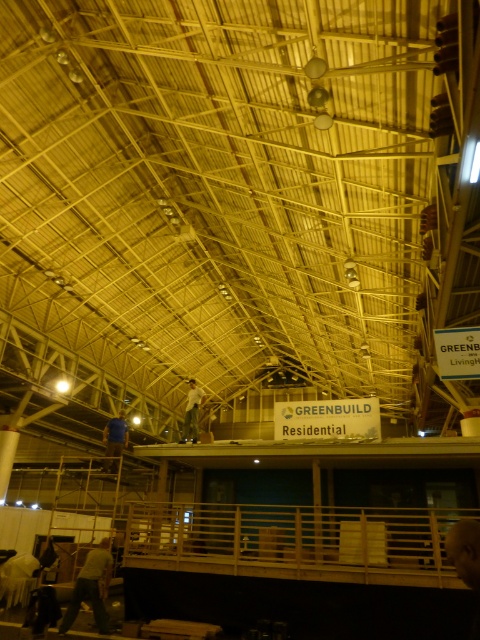
You are standing at the origin point of the coordinate system in the image. The coordinate system has its origin at the bottom left corner of the image. You need to locate the light gray fabric pants at lower left. What are their coordinates?

The coordinates of the light gray fabric pants at lower left are at point (91, 588).

You are an interior designer assessing the space for a new installation. You notice the light gray fabric pants at lower left and the blue fabric at center. Which fabric is shorter in height?

The light gray fabric pants at lower left is shorter than the blue fabric at center.